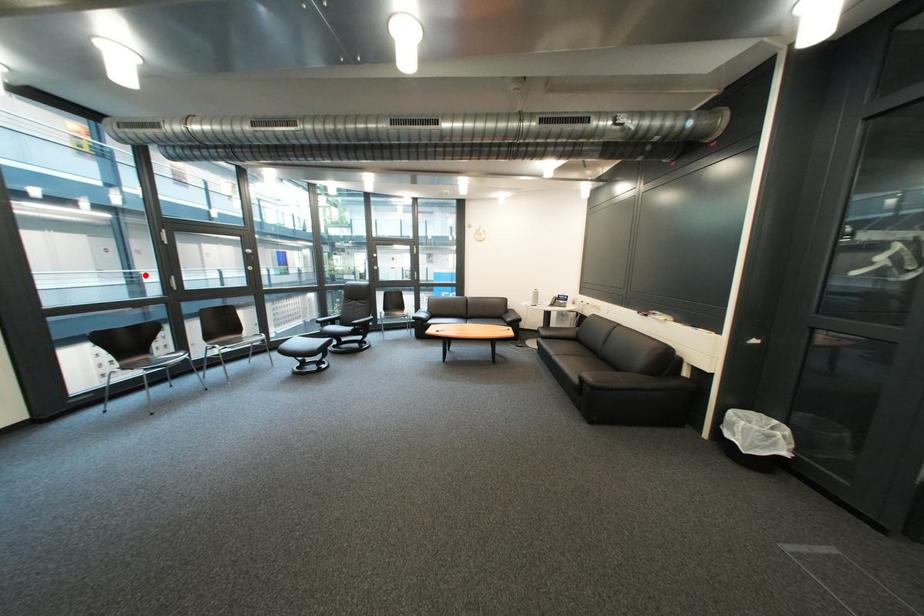
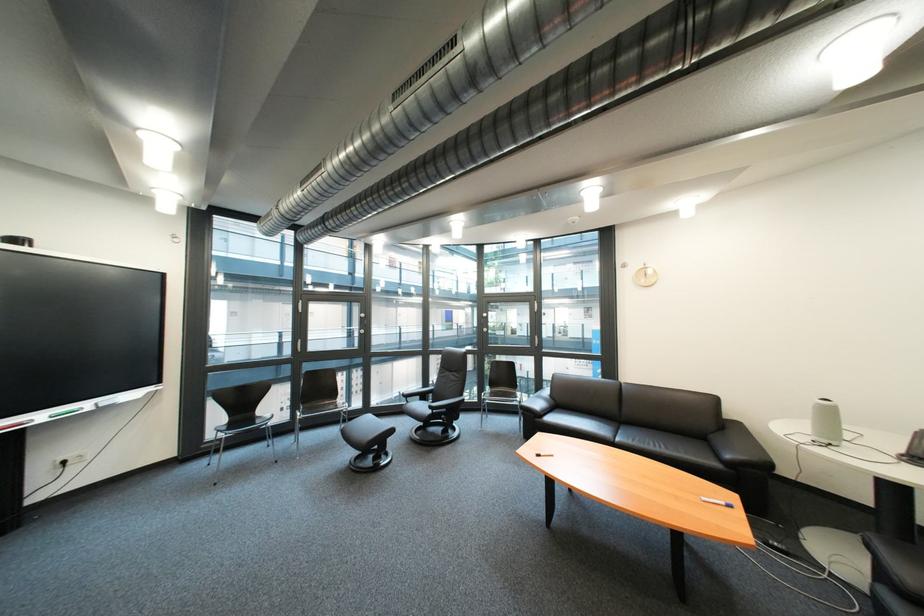
Question: A red point is marked in image1. In image2, is the corresponding 3D point closer to the camera or farther? Reply with the corresponding letter.

Choices:
 (A) The corresponding 3D point is closer.
 (B) The corresponding 3D point is farther.

Answer: (A)